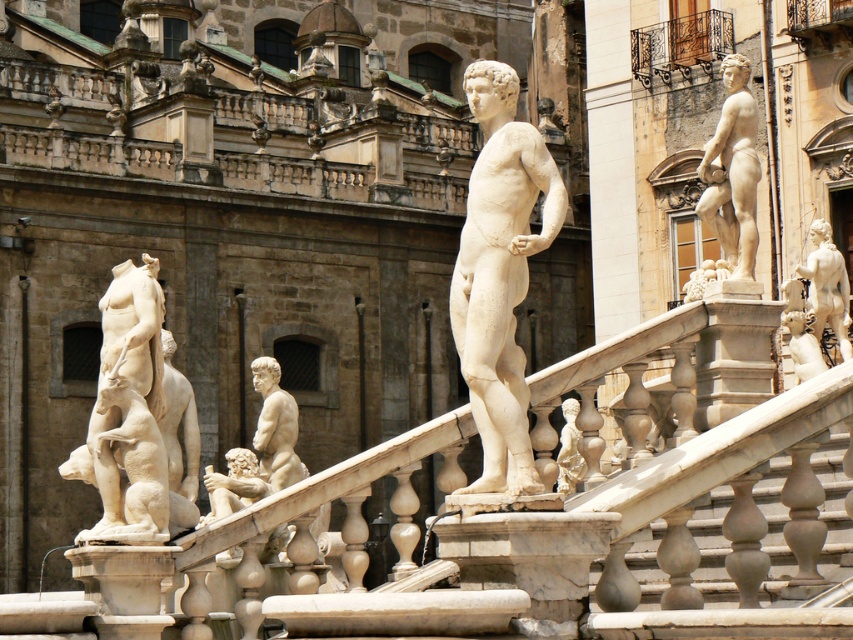
Does white marble statue at center appear on the left side of smooth beige statue at center?

No, white marble statue at center is not to the left of smooth beige statue at center.

Which is more to the left, white marble statue at center or smooth beige statue at center?

smooth beige statue at center

You are a GUI agent. You are given a task and a screenshot of the screen. Output one action in this format:
    pyautogui.click(x=<x>, y=<y>)
    Task: Click on the white marble statue at center
    This screenshot has height=640, width=853.
    Given the screenshot: What is the action you would take?
    pyautogui.click(x=500, y=273)

Locate an element on the screen. white marble statue at center is located at coordinates (500, 273).

Does point (732, 86) come closer to viewer compared to point (556, 483)?

Yes.

Locate an element on the screen. white marble statue at upper right is located at coordinates (732, 172).

Find the location of a particular element. white marble statue at upper right is located at coordinates (732, 172).

This screenshot has height=640, width=853. Find the location of `white marble statue at upper right`. white marble statue at upper right is located at coordinates (732, 172).

Can you confirm if white marble statue at left is positioned above white marble statue at upper right?

No, white marble statue at left is not above white marble statue at upper right.

Is white marble statue at left further to camera compared to white marble statue at upper right?

That is False.

This screenshot has height=640, width=853. What do you see at coordinates (138, 419) in the screenshot?
I see `white marble statue at left` at bounding box center [138, 419].

Identify the location of white marble statue at left. (138, 419).